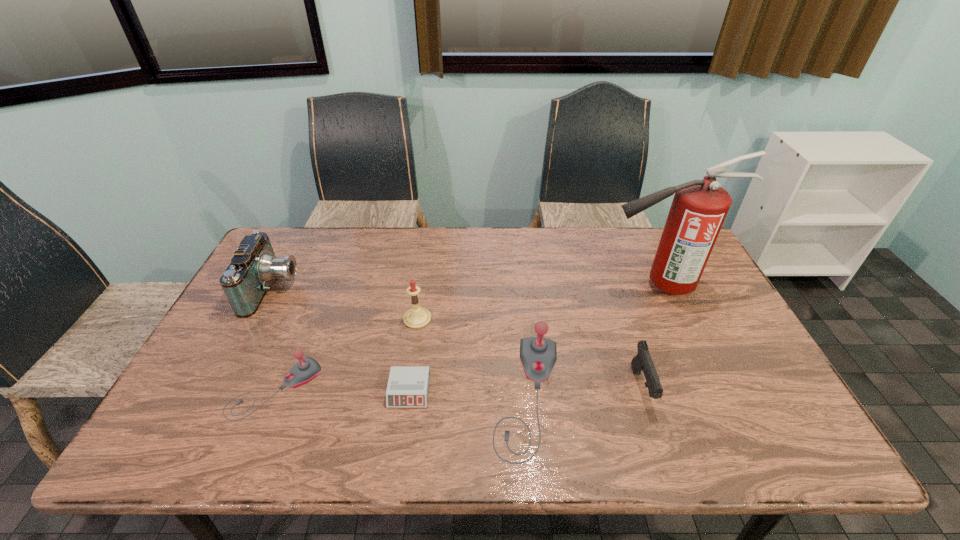
Locate an element on the screen. The image size is (960, 540). free spot located 0.170m on the right of the taller joystick is located at coordinates point(634,396).

You are a GUI agent. You are given a task and a screenshot of the screen. Output one action in this format:
    pyautogui.click(x=<x>, y=<y>)
    Task: Click on the free region located on the left of the candle
    This screenshot has width=960, height=540.
    Given the screenshot: What is the action you would take?
    pyautogui.click(x=267, y=319)

The width and height of the screenshot is (960, 540). I want to click on vacant area located 0.240m on the front-facing side of the camcorder, so click(x=374, y=289).

Where is `free space located at the nozzle of the tallest object`? free space located at the nozzle of the tallest object is located at coordinates (x=474, y=285).

Where is `free point located at the nozzle of the tallest object`? free point located at the nozzle of the tallest object is located at coordinates (562, 285).

At what (x,y) coordinates should I click in order to perform the action: click on vacant space located at the nozzle of the tallest object. Please return your answer as a coordinate pair (x, y). Looking at the image, I should click on (545, 285).

Identify the location of vacant space located 0.140m on the right of the shortest object. This screenshot has width=960, height=540. (486, 391).

Identify the location of object situated at the far edge. The width and height of the screenshot is (960, 540). (254, 266).

Where is `pistol at the near edge`? pistol at the near edge is located at coordinates (642, 361).

Where is `alarm clock present at the near edge`? This screenshot has height=540, width=960. alarm clock present at the near edge is located at coordinates (408, 386).